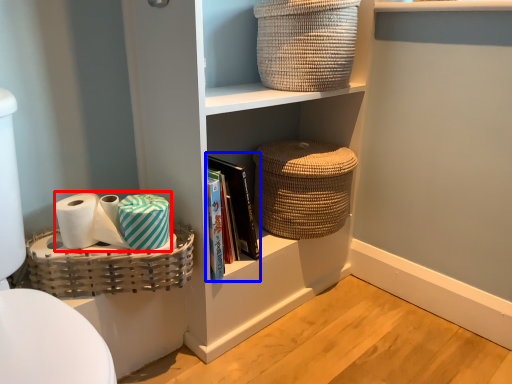
Question: Which object appears farthest to the camera in this image, toilet paper (highlighted by a red box) or book (highlighted by a blue box)?

Choices:
 (A) toilet paper
 (B) book

Answer: (B)